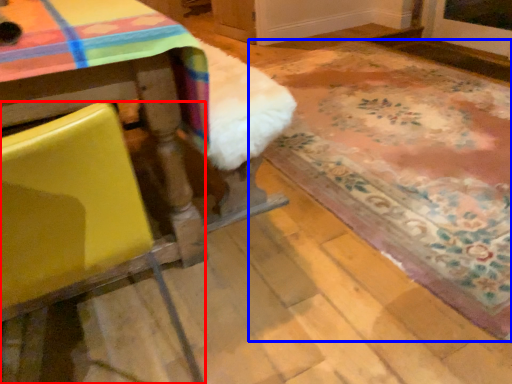
Question: Which object is closer to the camera taking this photo, chair (highlighted by a red box) or mat (highlighted by a blue box)?

Choices:
 (A) chair
 (B) mat

Answer: (A)